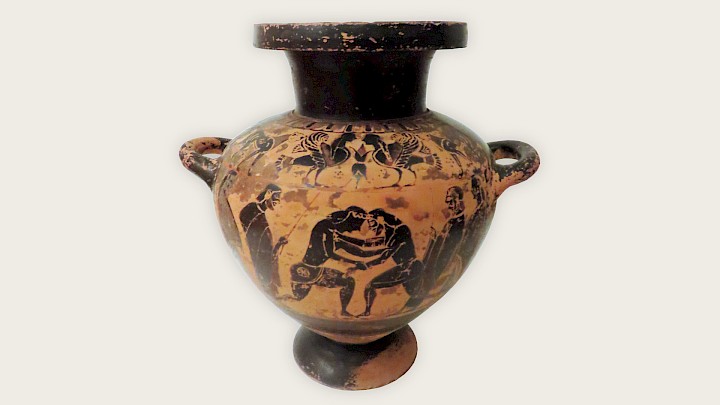
Identify the location of place to hold vase. (198, 141), (517, 161).